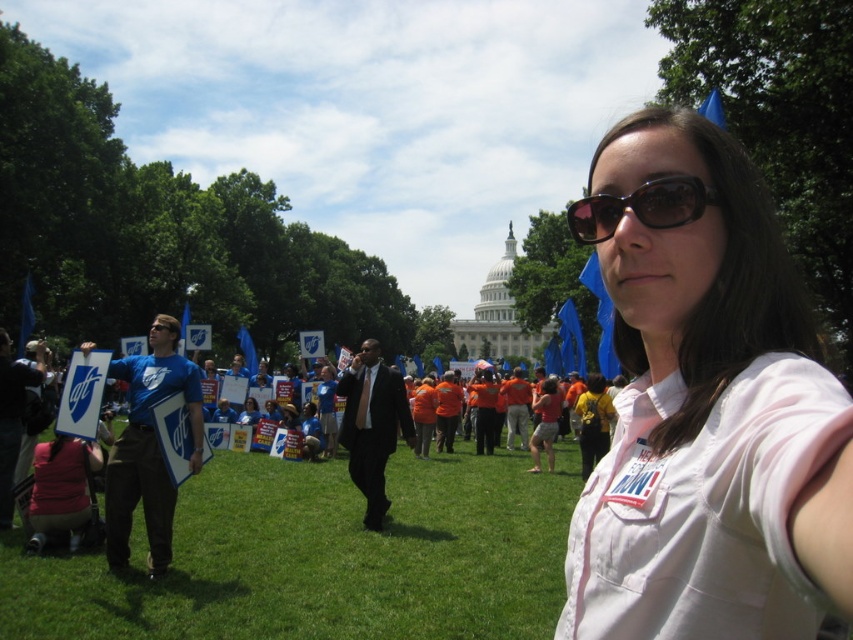
You are a photographer at the protest and want to capture a photo that includes both the white matte shirt at center and the black plastic sunglasses at upper center. Which object should you focus on first to ensure both are in the frame?

The white matte shirt at center is below the black plastic sunglasses at upper center, so you should focus on the black plastic sunglasses at upper center first to ensure both are in the frame.

You are a photographer at the protest, and you need to capture a photo that includes both the white matte shirt at center and the black plastic sunglasses at upper center. Given that your camera has a maximum zoom range of 10 meters, can you fit both objects into the frame without moving your position?

The distance between the white matte shirt at center and the black plastic sunglasses at upper center is 12.25 meters. Since your camera can only zoom up to 10 meters, you cannot fit both objects into the frame without moving closer or adjusting your position.